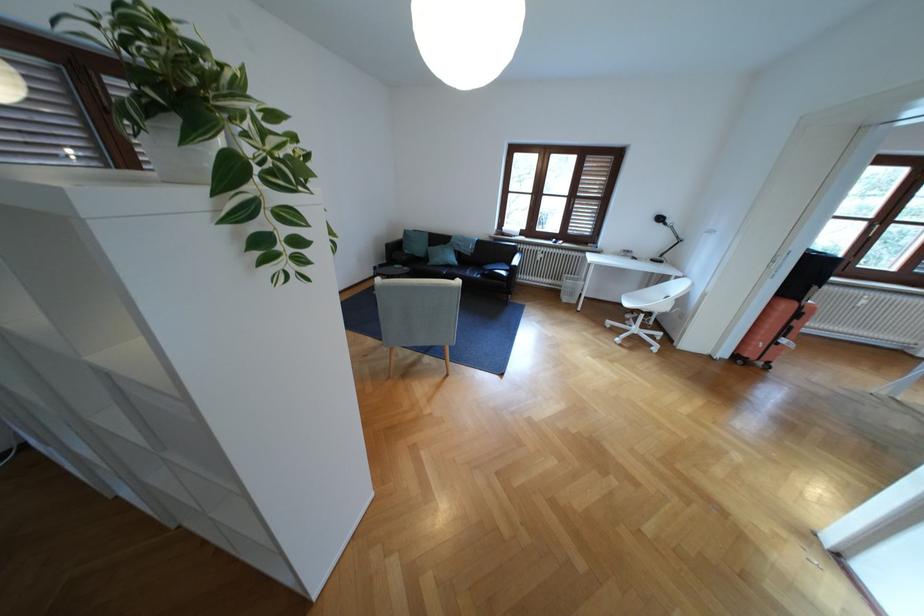
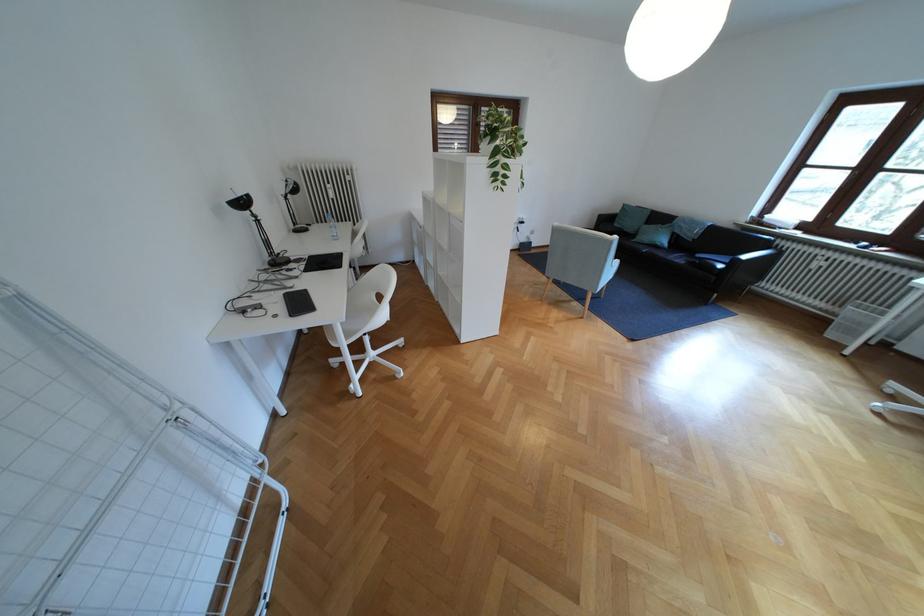
Find the pixel in the second image that matches point (417, 252) in the first image.

(626, 225)